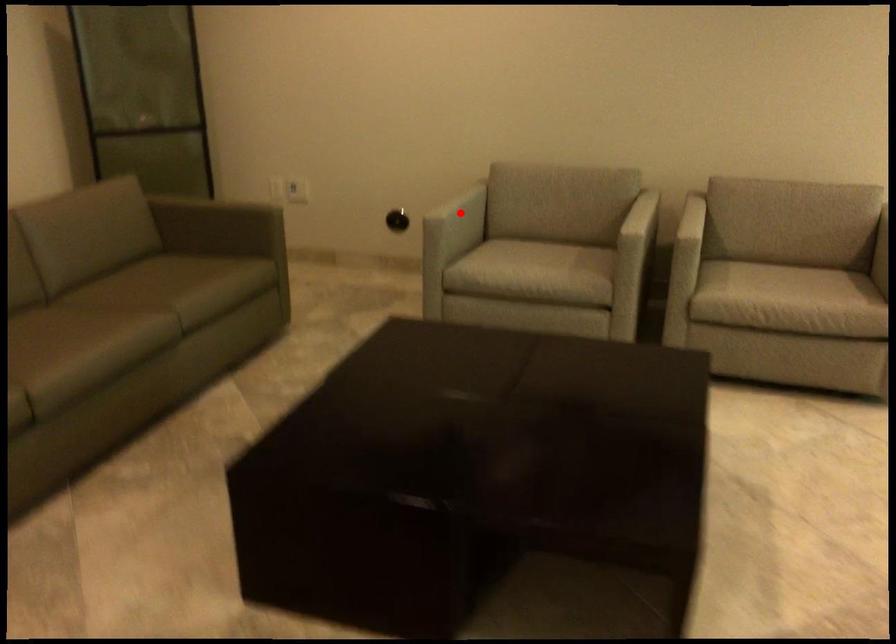
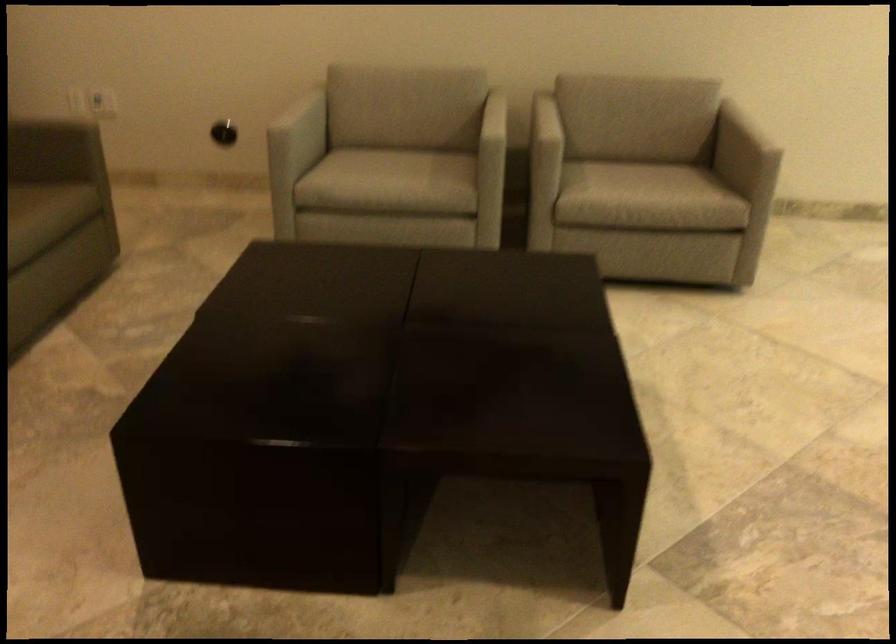
Question: I am providing you with two images of the same scene from different viewpoints. A red point is marked on the first image. At the location where the point appears in image 1, is it still visible in image 2?

Choices:
 (A) Yes
 (B) No

Answer: (A)